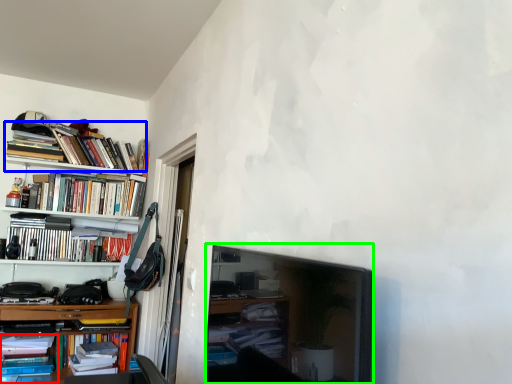
Question: Estimate the real-world distances between objects in this image. Which object is closer to book (highlighted by a red box), book (highlighted by a blue box) or picture frame (highlighted by a green box)?

Choices:
 (A) book
 (B) picture frame

Answer: (A)